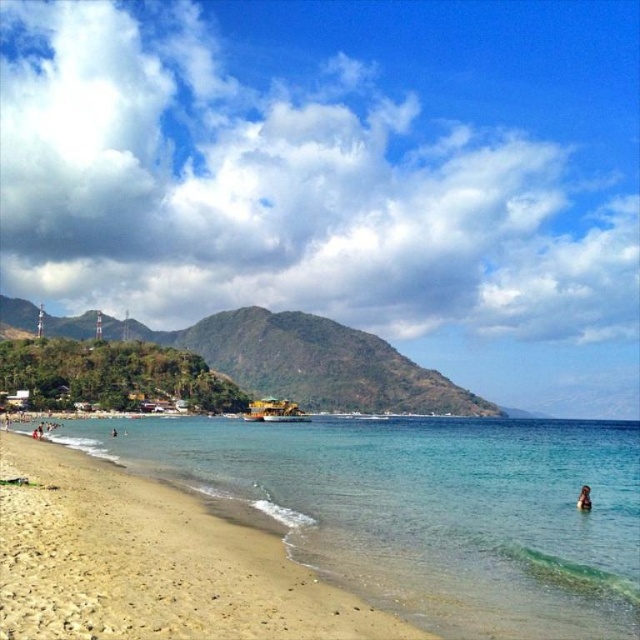
Question: Which point is farther from the camera taking this photo?

Choices:
 (A) (580, 502)
 (B) (230, 634)

Answer: (A)

Question: Among these objects, which one is nearest to the camera?

Choices:
 (A) brown leather person at lower right
 (B) light brown sand at lower left

Answer: (B)

Question: Is light brown sand at lower left above brown leather person at lower right?

Choices:
 (A) no
 (B) yes

Answer: (B)

Question: Is light brown sand at lower left closer to the viewer compared to brown leather person at lower right?

Choices:
 (A) no
 (B) yes

Answer: (B)

Question: Is light brown sand at lower left positioned before brown leather person at lower right?

Choices:
 (A) no
 (B) yes

Answer: (B)